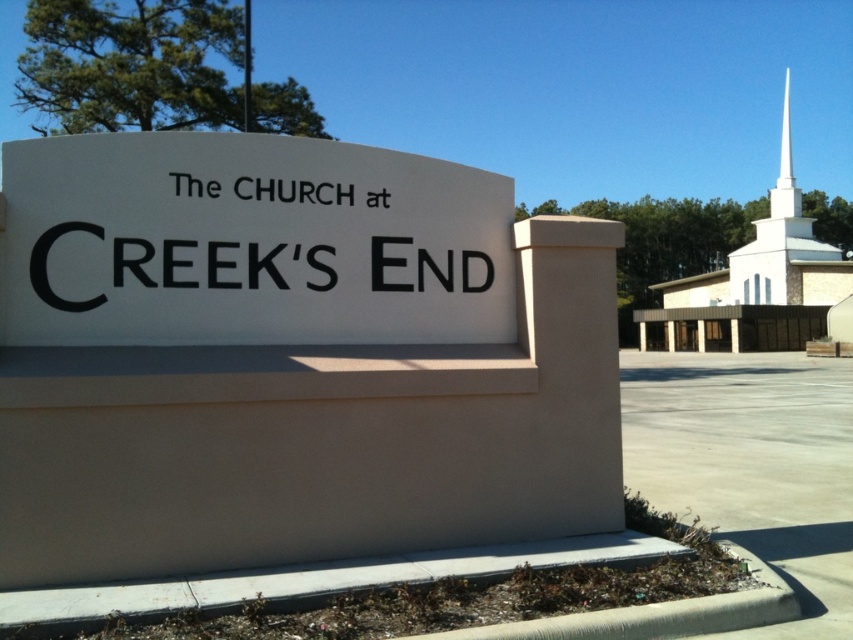
Looking at this image, you are standing in front of the church sign and want to locate both the white smooth steeple at upper right and the white smooth spire at upper right. Which one is positioned to the left when viewed from your perspective?

The white smooth steeple at upper right is positioned to the left of the white smooth spire at upper right.

You are a photographer trying to capture both the white matte sign at center and the white smooth steeple at upper right in a single frame. Given their sizes, which object should you focus on first to ensure both are clearly visible in the photo?

The white matte sign at center is smaller than the white smooth steeple at upper right. To ensure both are clearly visible, focus on the white smooth steeple at upper right first since it is larger and will be easier to frame, then adjust to include the smaller sign.

You are standing in front of the sign and looking at the church in the background. Which part of the church structure, the white smooth steeple at upper right or the white smooth spire at upper right, is closer to you?

The white smooth steeple at upper right is closer to the viewer than the white smooth spire at upper right.